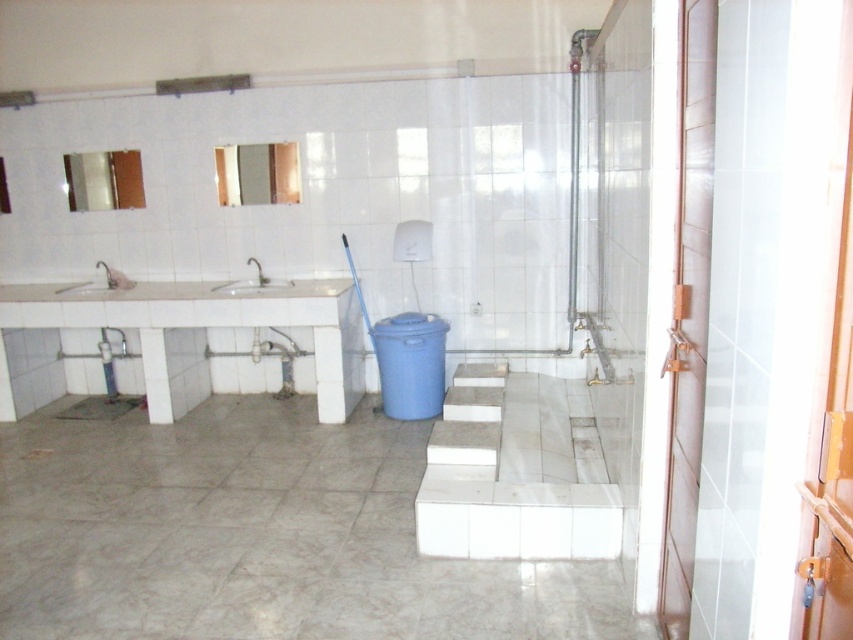
Question: Which of the following is the closest to the observer?

Choices:
 (A) white glossy sink at left
 (B) white glossy sink at center

Answer: (B)

Question: Which object is closer to the camera taking this photo?

Choices:
 (A) white glossy sink at left
 (B) white glossy sink at center

Answer: (B)

Question: Is white glossy sink at center to the left of white glossy sink at left from the viewer's perspective?

Choices:
 (A) yes
 (B) no

Answer: (B)

Question: Is white glossy sink at center in front of white glossy sink at left?

Choices:
 (A) no
 (B) yes

Answer: (B)

Question: In this image, where is white glossy sink at center located relative to white glossy sink at left?

Choices:
 (A) above
 (B) below

Answer: (A)